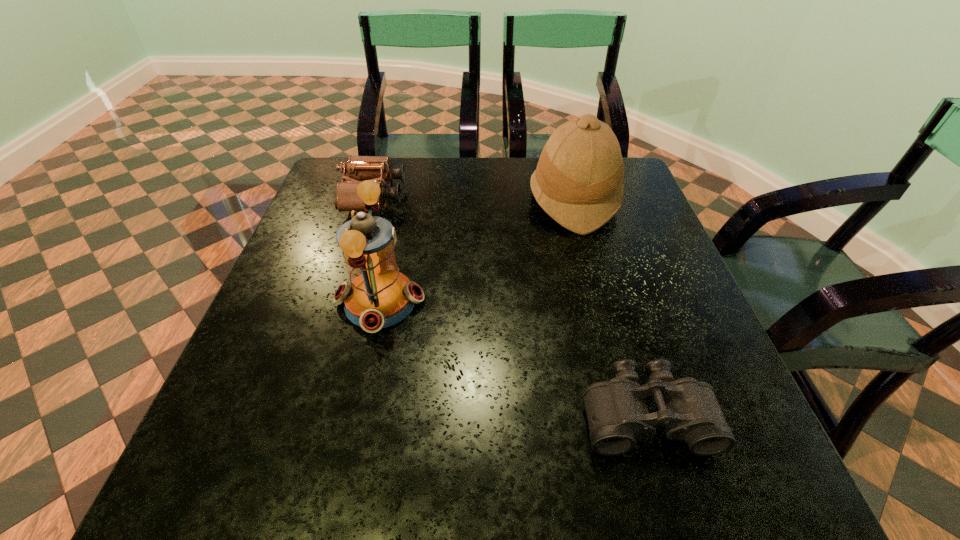
Identify the location of hat. (578, 182).

Image resolution: width=960 pixels, height=540 pixels. I want to click on lantern, so click(x=378, y=295).

Where is `the taller binoculars`? Image resolution: width=960 pixels, height=540 pixels. the taller binoculars is located at coordinates (379, 169).

At what (x,y) coordinates should I click in order to perform the action: click on the farther binoculars. Please return your answer as a coordinate pair (x, y). This screenshot has width=960, height=540. Looking at the image, I should click on (379, 169).

Locate an element on the screen. Image resolution: width=960 pixels, height=540 pixels. the right binoculars is located at coordinates (617, 414).

This screenshot has width=960, height=540. Identify the location of the shorter binoculars. (617, 414).

Identify the location of vacant space located 0.300m on the front-facing side of the hat. The image size is (960, 540). (418, 200).

Find the location of a particular element. This screenshot has height=540, width=960. free region located on the front-facing side of the hat is located at coordinates (380, 200).

Locate an element on the screen. free spot located 0.340m on the front-facing side of the hat is located at coordinates (403, 200).

Where is `free location located on the front-facing side of the third farthest object`? This screenshot has width=960, height=540. free location located on the front-facing side of the third farthest object is located at coordinates (616, 301).